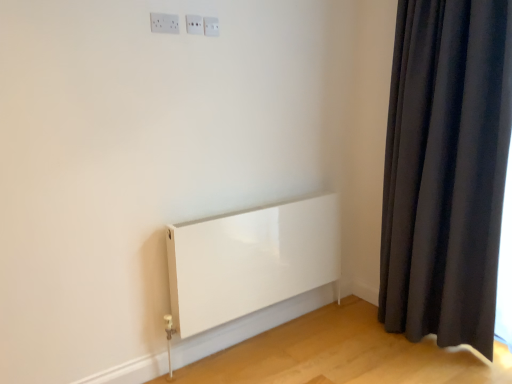
What is the approximate height of white plastic electric outlet at upper center, marked as the second electric outlet in a front-to-back arrangement?

3.86 inches.

Describe the element at coordinates (164, 23) in the screenshot. I see `white glossy electric outlet at upper center, the 1th electric outlet positioned from the front` at that location.

Locate an element on the screen. Image resolution: width=512 pixels, height=384 pixels. white plastic electric outlet at upper center, positioned as the second electric outlet in right-to-left order is located at coordinates [194, 24].

Looking at this image, from their relative heights in the image, would you say white plastic electric outlet at upper center, arranged as the 2th electric outlet when viewed from the back, is taller or shorter than white glossy electric outlet at upper center, which appears as the third electric outlet when viewed from the right?

In the image, white plastic electric outlet at upper center, arranged as the 2th electric outlet when viewed from the back, appears to be shorter than white glossy electric outlet at upper center, which appears as the third electric outlet when viewed from the right.

Is point (192, 28) positioned after point (170, 22)?

Yes.

In the image, is white plastic electric outlet at upper center, marked as the second electric outlet in a front-to-back arrangement, positioned in front of or behind white glossy electric outlet at upper center, arranged as the 3th electric outlet when viewed from the back?

white plastic electric outlet at upper center, marked as the second electric outlet in a front-to-back arrangement, is positioned farther from the viewer than white glossy electric outlet at upper center, arranged as the 3th electric outlet when viewed from the back.

How far apart are white plastic electric outlet at upper center, positioned as the second electric outlet in right-to-left order, and white glossy electric outlet at upper center, arranged as the 3th electric outlet when viewed from the back?

white plastic electric outlet at upper center, positioned as the second electric outlet in right-to-left order, and white glossy electric outlet at upper center, arranged as the 3th electric outlet when viewed from the back, are 11.16 centimeters apart.

Is white plastic electric outlet at upper center, marked as the second electric outlet in a front-to-back arrangement, smaller than white plastic electric outlet at upper center, which is the third electric outlet in left-to-right order?

Yes, white plastic electric outlet at upper center, marked as the second electric outlet in a front-to-back arrangement, is smaller than white plastic electric outlet at upper center, which is the third electric outlet in left-to-right order.

Is white plastic electric outlet at upper center, arranged as the 2th electric outlet when viewed from the back, far from white plastic electric outlet at upper center, the 1th electric outlet positioned from the right?

No, white plastic electric outlet at upper center, arranged as the 2th electric outlet when viewed from the back, is not far away from white plastic electric outlet at upper center, the 1th electric outlet positioned from the right.

Considering the positions of objects white plastic electric outlet at upper center, positioned as the second electric outlet in right-to-left order, and white plastic electric outlet at upper center, which ranks as the first electric outlet in back-to-front order, in the image provided, who is more to the right, white plastic electric outlet at upper center, positioned as the second electric outlet in right-to-left order, or white plastic electric outlet at upper center, which ranks as the first electric outlet in back-to-front order,?

Positioned to the right is white plastic electric outlet at upper center, which ranks as the first electric outlet in back-to-front order.

Is white glossy electric outlet at upper center, arranged as the 3th electric outlet when viewed from the back, facing away from white plastic electric outlet at upper center, marked as the second electric outlet in a front-to-back arrangement?

No, white plastic electric outlet at upper center, marked as the second electric outlet in a front-to-back arrangement, is not at the back of white glossy electric outlet at upper center, arranged as the 3th electric outlet when viewed from the back.

Considering the sizes of white glossy electric outlet at upper center, arranged as the 3th electric outlet when viewed from the back, and white plastic electric outlet at upper center, marked as the second electric outlet in a front-to-back arrangement, in the image, is white glossy electric outlet at upper center, arranged as the 3th electric outlet when viewed from the back, bigger or smaller than white plastic electric outlet at upper center, marked as the second electric outlet in a front-to-back arrangement,?

In the image, white glossy electric outlet at upper center, arranged as the 3th electric outlet when viewed from the back, appears to be larger than white plastic electric outlet at upper center, marked as the second electric outlet in a front-to-back arrangement.

Is white glossy electric outlet at upper center, the 1th electric outlet positioned from the front, not close to white plastic electric outlet at upper center, arranged as the second electric outlet when viewed from the left?

No, white glossy electric outlet at upper center, the 1th electric outlet positioned from the front, is not far from white plastic electric outlet at upper center, arranged as the second electric outlet when viewed from the left.

From a real-world perspective, is white glossy electric outlet at upper center, arranged as the 3th electric outlet when viewed from the back, above or below white plastic electric outlet at upper center, arranged as the 2th electric outlet when viewed from the back?

From a real-world perspective, white glossy electric outlet at upper center, arranged as the 3th electric outlet when viewed from the back, is physically below white plastic electric outlet at upper center, arranged as the 2th electric outlet when viewed from the back.

Where is `electric outlet below the white plastic electric outlet at upper center, the 1th electric outlet positioned from the right (from a real-world perspective)`? This screenshot has height=384, width=512. electric outlet below the white plastic electric outlet at upper center, the 1th electric outlet positioned from the right (from a real-world perspective) is located at coordinates (164, 23).

Considering the positions of objects white glossy electric outlet at upper center, the first electric outlet in the left-to-right sequence, and white plastic electric outlet at upper center, which ranks as the first electric outlet in back-to-front order, in the image provided, who is in front, white glossy electric outlet at upper center, the first electric outlet in the left-to-right sequence, or white plastic electric outlet at upper center, which ranks as the first electric outlet in back-to-front order,?

white glossy electric outlet at upper center, the first electric outlet in the left-to-right sequence, is closer to the camera.

Is point (175, 28) farther from viewer compared to point (208, 19)?

No, (175, 28) is in front of (208, 19).

Who is taller, white plastic electric outlet at upper center, which is the third electric outlet in left-to-right order, or white plastic electric outlet at upper center, positioned as the second electric outlet in right-to-left order?

white plastic electric outlet at upper center, positioned as the second electric outlet in right-to-left order, is taller.

Consider the image. Which of these two, white plastic electric outlet at upper center, which ranks as the 3th electric outlet in front-to-back order, or white plastic electric outlet at upper center, marked as the second electric outlet in a front-to-back arrangement, is smaller?

white plastic electric outlet at upper center, marked as the second electric outlet in a front-to-back arrangement, is smaller.

Looking at this image, could you measure the distance between white plastic electric outlet at upper center, which is the third electric outlet in left-to-right order, and white plastic electric outlet at upper center, arranged as the 2th electric outlet when viewed from the back?

white plastic electric outlet at upper center, which is the third electric outlet in left-to-right order, is 2.22 inches from white plastic electric outlet at upper center, arranged as the 2th electric outlet when viewed from the back.

Would you consider white plastic electric outlet at upper center, the 1th electric outlet positioned from the right, to be distant from white plastic electric outlet at upper center, positioned as the second electric outlet in right-to-left order?

That's not correct — white plastic electric outlet at upper center, the 1th electric outlet positioned from the right, is a little close to white plastic electric outlet at upper center, positioned as the second electric outlet in right-to-left order.

Which is closer to the camera, (209, 21) or (166, 15)?

Point (209, 21) appears to be farther away from the viewer than point (166, 15).

In the scene shown: Is white plastic electric outlet at upper center, the 1th electric outlet positioned from the right, located outside white glossy electric outlet at upper center, the first electric outlet in the left-to-right sequence?

Yes, white plastic electric outlet at upper center, the 1th electric outlet positioned from the right, is not within white glossy electric outlet at upper center, the first electric outlet in the left-to-right sequence.

Is white plastic electric outlet at upper center, which is the third electric outlet in left-to-right order, placed right next to white glossy electric outlet at upper center, arranged as the 3th electric outlet when viewed from the back?

No, white plastic electric outlet at upper center, which is the third electric outlet in left-to-right order, is not next to white glossy electric outlet at upper center, arranged as the 3th electric outlet when viewed from the back.

This screenshot has width=512, height=384. In order to click on the 1st electric outlet to the right of the white glossy electric outlet at upper center, arranged as the 3th electric outlet when viewed from the back, starting your count from the anchor in this screenshot , I will do `click(194, 24)`.

The width and height of the screenshot is (512, 384). What are the coordinates of `electric outlet that is the 1st object directly below the white plastic electric outlet at upper center, marked as the second electric outlet in a front-to-back arrangement (from a real-world perspective)` in the screenshot? It's located at (211, 26).

Which object lies further to the anchor point white plastic electric outlet at upper center, the 1th electric outlet positioned from the right, white plastic electric outlet at upper center, arranged as the 2th electric outlet when viewed from the back, or white glossy electric outlet at upper center, arranged as the 3th electric outlet when viewed from the back?

Among the two, white glossy electric outlet at upper center, arranged as the 3th electric outlet when viewed from the back, is located further to white plastic electric outlet at upper center, the 1th electric outlet positioned from the right.

When comparing their distances from white glossy electric outlet at upper center, the first electric outlet in the left-to-right sequence, does white plastic electric outlet at upper center, arranged as the second electric outlet when viewed from the left, or white plastic electric outlet at upper center, which ranks as the 3th electric outlet in front-to-back order, seem closer?

white plastic electric outlet at upper center, arranged as the second electric outlet when viewed from the left, is closer to white glossy electric outlet at upper center, the first electric outlet in the left-to-right sequence.

Consider the image. Estimate the real-world distances between objects in this image. Which object is further from white plastic electric outlet at upper center, positioned as the second electric outlet in right-to-left order, white plastic electric outlet at upper center, which ranks as the first electric outlet in back-to-front order, or white glossy electric outlet at upper center, arranged as the 3th electric outlet when viewed from the back?

Among the two, white glossy electric outlet at upper center, arranged as the 3th electric outlet when viewed from the back, is located further to white plastic electric outlet at upper center, positioned as the second electric outlet in right-to-left order.

From the image, which object appears to be nearer to white glossy electric outlet at upper center, arranged as the 3th electric outlet when viewed from the back, white plastic electric outlet at upper center, which ranks as the first electric outlet in back-to-front order, or white plastic electric outlet at upper center, arranged as the second electric outlet when viewed from the left?

Based on the image, white plastic electric outlet at upper center, arranged as the second electric outlet when viewed from the left, appears to be nearer to white glossy electric outlet at upper center, arranged as the 3th electric outlet when viewed from the back.

Considering their positions, is white glossy electric outlet at upper center, which appears as the third electric outlet when viewed from the right, positioned further to white plastic electric outlet at upper center, the 1th electric outlet positioned from the right, than white plastic electric outlet at upper center, arranged as the 2th electric outlet when viewed from the back?

white glossy electric outlet at upper center, which appears as the third electric outlet when viewed from the right, is positioned further to the anchor white plastic electric outlet at upper center, the 1th electric outlet positioned from the right.

From the image, which object appears to be farther from white plastic electric outlet at upper center, positioned as the second electric outlet in right-to-left order, white glossy electric outlet at upper center, arranged as the 3th electric outlet when viewed from the back, or white plastic electric outlet at upper center, which is the third electric outlet in left-to-right order?

Based on the image, white glossy electric outlet at upper center, arranged as the 3th electric outlet when viewed from the back, appears to be further to white plastic electric outlet at upper center, positioned as the second electric outlet in right-to-left order.

Locate an element on the screen. electric outlet located between white glossy electric outlet at upper center, arranged as the 3th electric outlet when viewed from the back, and white plastic electric outlet at upper center, which ranks as the 3th electric outlet in front-to-back order, in the left-right direction is located at coordinates (194, 24).